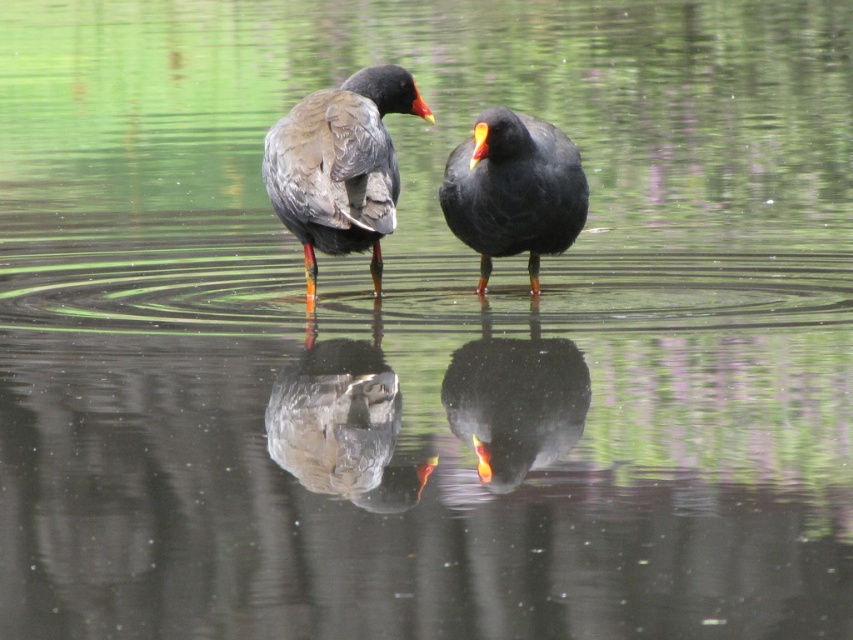
Question: Which object is the farthest from the yellow-orange beak at center?

Choices:
 (A) matte black duck at center
 (B) shiny black bird at center
 (C) matte gray bird at center
 (D) dark gray matte bird at center

Answer: (C)

Question: In this image, where is matte black duck at center located relative to shiny black bird at center?

Choices:
 (A) right
 (B) left

Answer: (A)

Question: Does shiny black bird at center appear on the left side of yellow-orange beak at center?

Choices:
 (A) no
 (B) yes

Answer: (A)

Question: Which object is the closest to the matte black duck at center?

Choices:
 (A) matte gray bird at center
 (B) yellow-orange beak at center
 (C) dark gray matte bird at center

Answer: (C)

Question: Which object is farther from the camera taking this photo?

Choices:
 (A) shiny black bird at center
 (B) yellow-orange beak at center

Answer: (B)

Question: Can you confirm if matte gray bird at center is positioned to the right of dark gray matte bird at center?

Choices:
 (A) no
 (B) yes

Answer: (B)